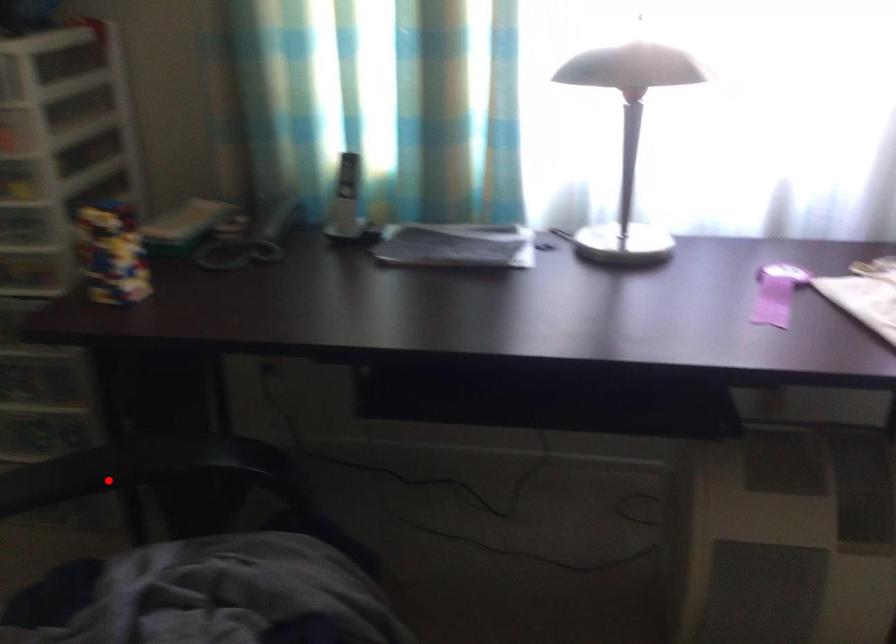
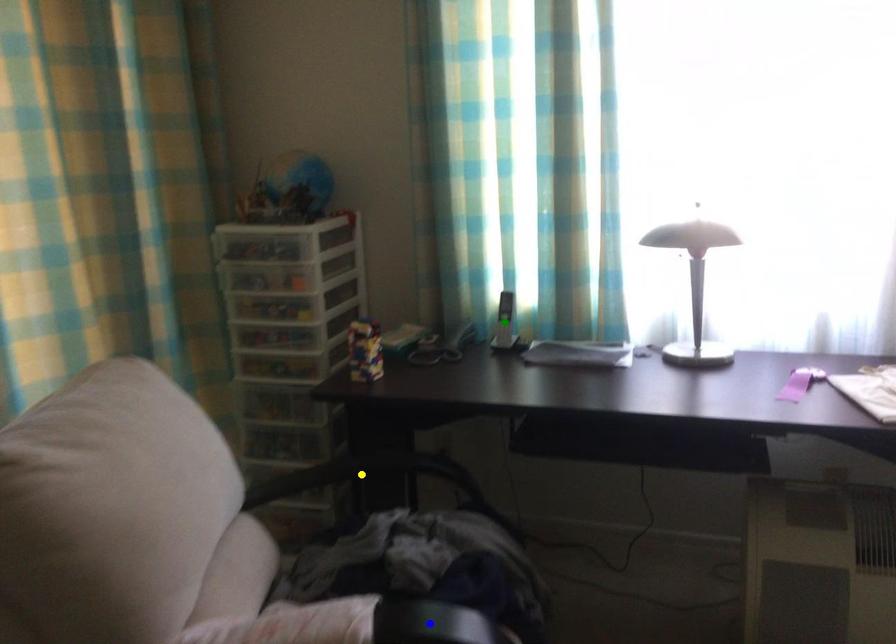
Question: I am providing you with two images of the same scene from different viewpoints. A red point is marked on the first image. You are given multiple points on the second image. Which spot in image 2 lines up with the point in image 1?

Choices:
 (A) yellow point
 (B) blue point
 (C) green point

Answer: (A)